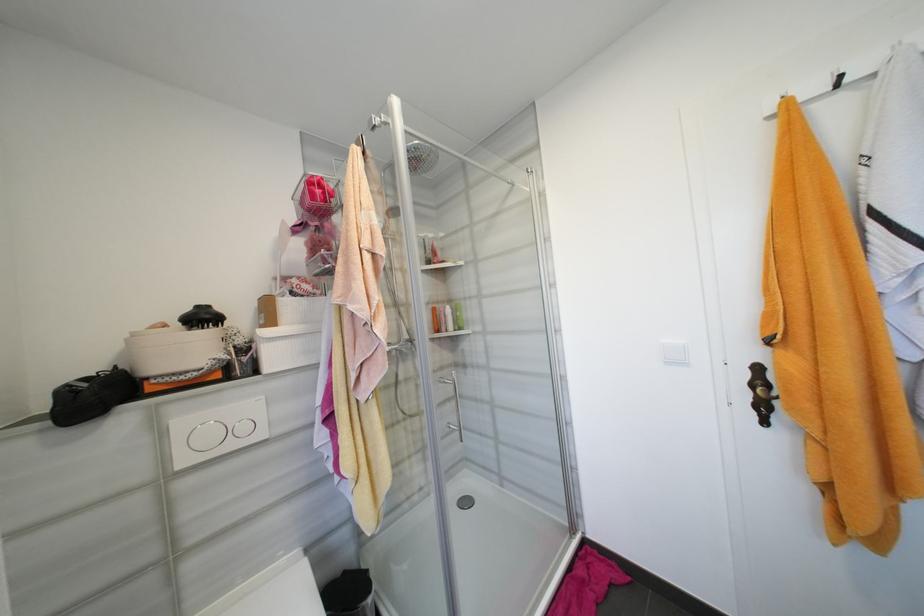
The height and width of the screenshot is (616, 924). What do you see at coordinates (447, 318) in the screenshot?
I see `the white bottle` at bounding box center [447, 318].